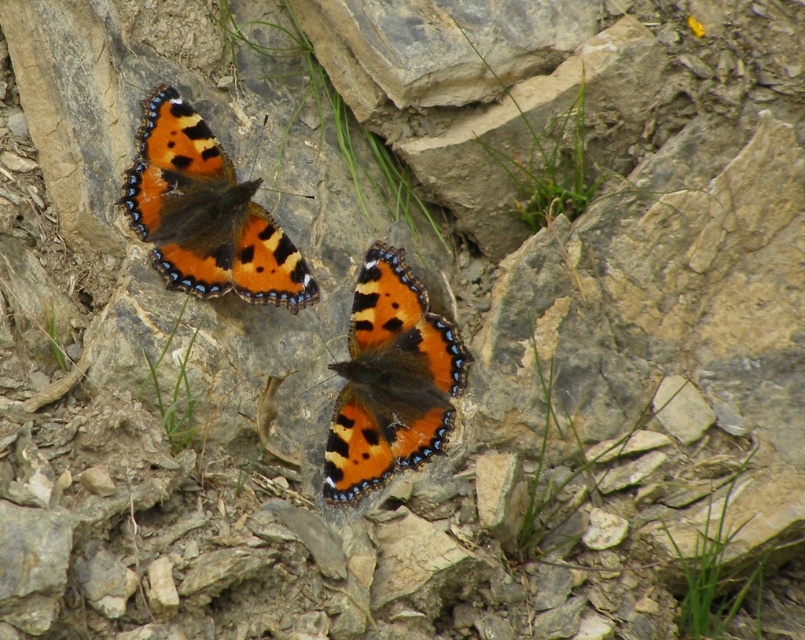
Question: Which of the following is the closest to the observer?

Choices:
 (A) (248, 234)
 (B) (368, 388)

Answer: (B)

Question: Can you confirm if orange matte butterfly at upper left is bigger than orange matte butterfly at center?

Choices:
 (A) no
 (B) yes

Answer: (A)

Question: Does orange matte butterfly at upper left have a lesser width compared to orange matte butterfly at center?

Choices:
 (A) yes
 (B) no

Answer: (B)

Question: Can you confirm if orange matte butterfly at upper left is positioned to the right of orange matte butterfly at center?

Choices:
 (A) yes
 (B) no

Answer: (B)

Question: Which object appears closest to the camera in this image?

Choices:
 (A) orange matte butterfly at center
 (B) orange matte butterfly at upper left

Answer: (A)

Question: Which point is farther from the camera taking this photo?

Choices:
 (A) (424, 380)
 (B) (155, 209)

Answer: (A)